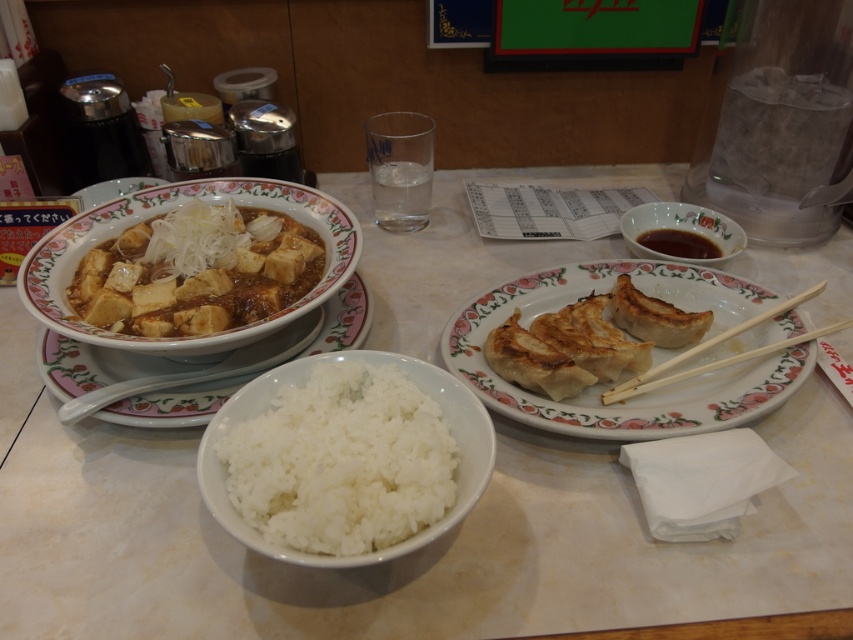
Question: Which point is closer to the camera taking this photo?

Choices:
 (A) (152, 221)
 (B) (734, 324)
 (C) (503, 346)

Answer: (C)

Question: Among these objects, which one is farthest from the camera?

Choices:
 (A) white fluffy rice at center
 (B) matte brown tofu at center
 (C) satin brown sauce at upper right

Answer: (C)

Question: Can you confirm if white glossy rice bowl at lower center is bigger than wooden chopsticks at right?

Choices:
 (A) yes
 (B) no

Answer: (A)

Question: Observing the image, what is the correct spatial positioning of golden brown dough at center right in reference to matte brown tofu at center?

Choices:
 (A) below
 (B) above

Answer: (A)

Question: Considering the relative positions of white glossy rice bowl at lower center and golden brown dough at center right in the image provided, where is white glossy rice bowl at lower center located with respect to golden brown dough at center right?

Choices:
 (A) right
 (B) left

Answer: (B)

Question: Considering the real-world distances, which object is farthest from the wooden chopsticks at right?

Choices:
 (A) white glossy rice bowl at lower center
 (B) matte ceramic bowl at center
 (C) golden brown dough at center right

Answer: (B)